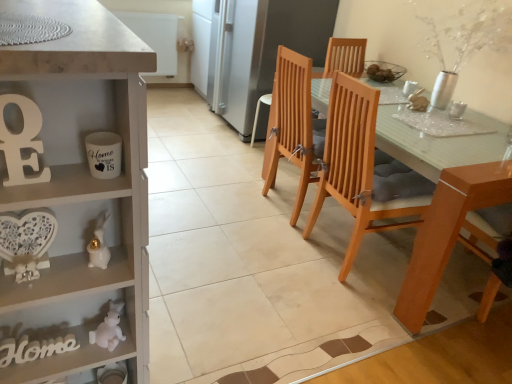
The height and width of the screenshot is (384, 512). I want to click on free space to the right of clear glass cup at upper right, which is the third coffee cup in left-to-right order, so click(484, 122).